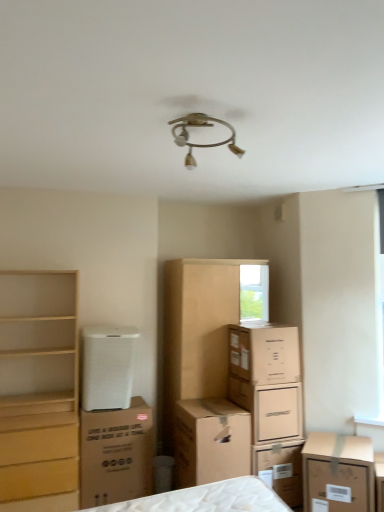
Question: In which direction should I rotate to look at metallic gold ceiling light at upper center?

Choices:
 (A) left
 (B) right

Answer: (B)

Question: Should I look upward or downward to see white mesh air purifier at lower left?

Choices:
 (A) up
 (B) down

Answer: (B)

Question: Is light wood chest of drawers at left at the right side of metallic gold ceiling light at upper center?

Choices:
 (A) yes
 (B) no

Answer: (B)

Question: From the image's perspective, is light wood chest of drawers at left located above metallic gold ceiling light at upper center?

Choices:
 (A) yes
 (B) no

Answer: (B)

Question: Considering the relative positions of light wood chest of drawers at left and metallic gold ceiling light at upper center in the image provided, is light wood chest of drawers at left in front of metallic gold ceiling light at upper center?

Choices:
 (A) no
 (B) yes

Answer: (A)

Question: Considering the relative sizes of light wood chest of drawers at left and metallic gold ceiling light at upper center in the image provided, is light wood chest of drawers at left shorter than metallic gold ceiling light at upper center?

Choices:
 (A) no
 (B) yes

Answer: (A)

Question: Does light wood chest of drawers at left have a smaller size compared to metallic gold ceiling light at upper center?

Choices:
 (A) no
 (B) yes

Answer: (A)

Question: Is light wood chest of drawers at left to the left of metallic gold ceiling light at upper center from the viewer's perspective?

Choices:
 (A) no
 (B) yes

Answer: (B)

Question: Is light wood chest of drawers at left at the right side of white cardboard box at center, placed as the fourth cardboard box when sorted from left to right?

Choices:
 (A) no
 (B) yes

Answer: (A)

Question: From the image's perspective, does light wood chest of drawers at left appear higher than white cardboard box at center, which ranks as the second cardboard box in right-to-left order?

Choices:
 (A) yes
 (B) no

Answer: (A)

Question: Does light wood chest of drawers at left appear on the left side of white cardboard box at center, which ranks as the second cardboard box in right-to-left order?

Choices:
 (A) yes
 (B) no

Answer: (A)

Question: Does light wood chest of drawers at left have a larger size compared to white cardboard box at center, placed as the fourth cardboard box when sorted from left to right?

Choices:
 (A) no
 (B) yes

Answer: (B)

Question: Considering the relative sizes of light wood chest of drawers at left and white cardboard box at center, placed as the fourth cardboard box when sorted from left to right, in the image provided, is light wood chest of drawers at left thinner than white cardboard box at center, placed as the fourth cardboard box when sorted from left to right,?

Choices:
 (A) no
 (B) yes

Answer: (A)

Question: Does light wood chest of drawers at left have a smaller size compared to white cardboard box at center, placed as the fourth cardboard box when sorted from left to right?

Choices:
 (A) no
 (B) yes

Answer: (A)

Question: From a real-world perspective, is brown cardboard dresser at center physically below light wood chest of drawers at left?

Choices:
 (A) yes
 (B) no

Answer: (B)